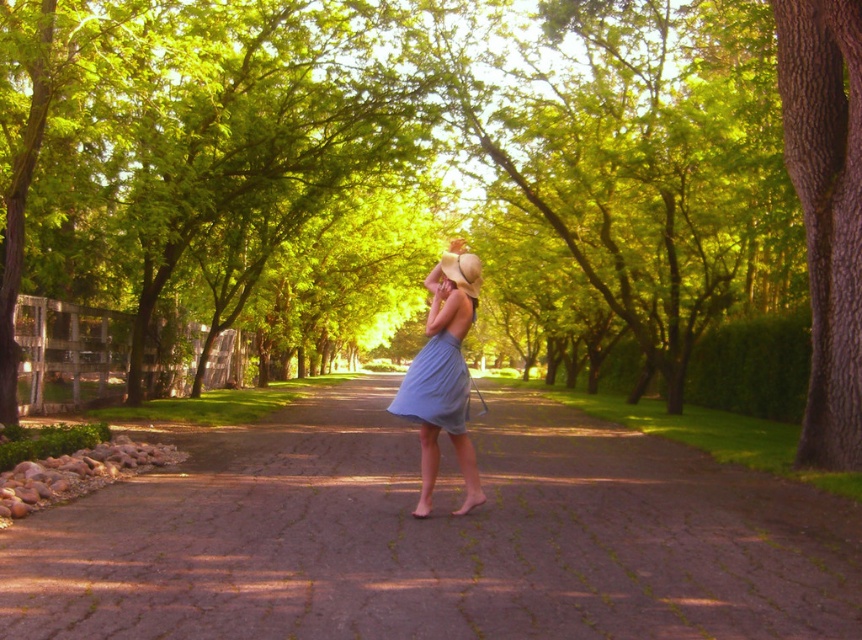
From the picture: You are standing at the starting point of the paved stone path at center and want to reach the brown rough bark tree at right. Which object is closer to you?

The paved stone path at center is closer to you since it is shorter than the brown rough bark tree at right.

You are standing at the point marked as point (692, 228) in the park. A friend is approaching you from the direction of the trees. If your friend walks at a speed of 1.5 meters per second, how many seconds will it take for them to reach you?

The distance between the point (692, 228) and the viewer is 18.75 meters. Since your friend is approaching from the direction of the trees, they need to cover this distance. At a speed of 1.5 meters per second, it will take 18.75 divided by 1.5, which equals 12.5 seconds.

You are standing at the start of the paved stone path at center and want to walk towards the brown rough bark tree at right. Is the tree directly ahead of you along the path?

The paved stone path at center is positioned under brown rough bark tree at right, so the tree is directly above the path. Therefore, as you walk along the paved stone path at center towards the tree, the brown rough bark tree at right will be directly ahead and above you along the path.